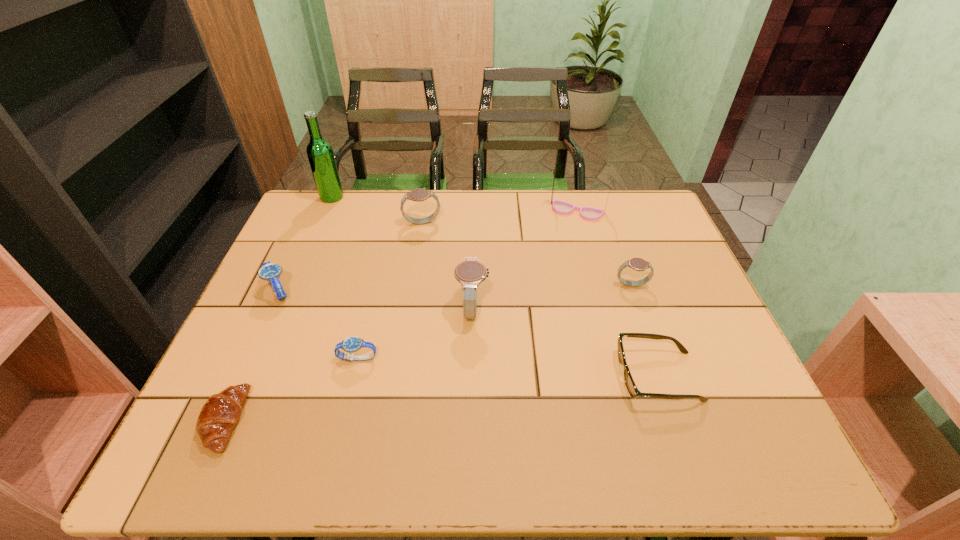
Locate an element on the screen. vacant point located 0.230m on the back of the smallest gray watch is located at coordinates (612, 227).

Locate an element on the screen. This screenshot has width=960, height=540. vacant space situated 0.110m on the right of the bigger blue watch is located at coordinates (337, 291).

Where is `free location located 0.110m on the lenses of the shorter spectacles`? free location located 0.110m on the lenses of the shorter spectacles is located at coordinates (567, 376).

Where is `vacant position located 0.110m on the lenses of the shorter spectacles`? The width and height of the screenshot is (960, 540). vacant position located 0.110m on the lenses of the shorter spectacles is located at coordinates click(567, 376).

What are the coordinates of `vacant region located on the lenses of the shorter spectacles` in the screenshot? It's located at (587, 376).

This screenshot has width=960, height=540. In order to click on vacant space positioned 0.200m on the right of the nearest watch in this screenshot , I will do `click(467, 358)`.

Locate an element on the screen. free point located on the back of the crescent roll is located at coordinates (295, 262).

The height and width of the screenshot is (540, 960). Find the location of `beer bottle located at the far edge`. beer bottle located at the far edge is located at coordinates (320, 154).

Locate an element on the screen. spectacles situated at the far edge is located at coordinates (560, 207).

This screenshot has height=540, width=960. I want to click on watch located in the far edge section of the desktop, so click(x=420, y=194).